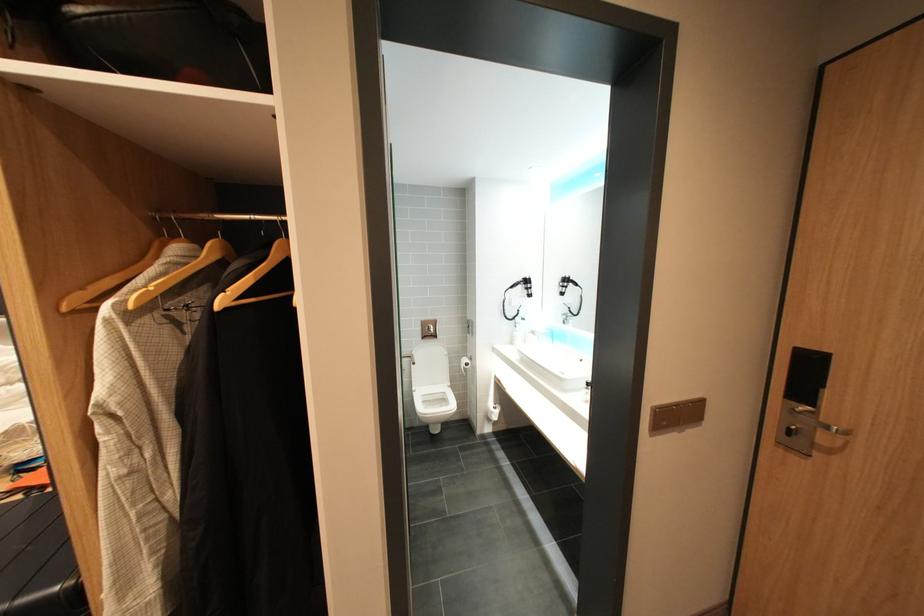
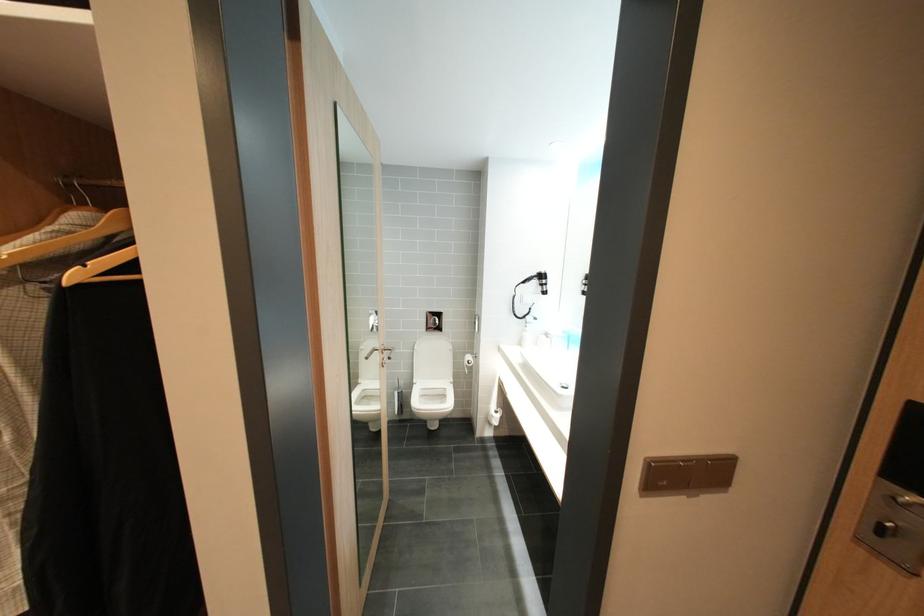
Question: The images are taken continuously from a first-person perspective. In which direction is your viewpoint rotating?

Choices:
 (A) Left
 (B) Right
 (C) Up
 (D) Down

Answer: (A)